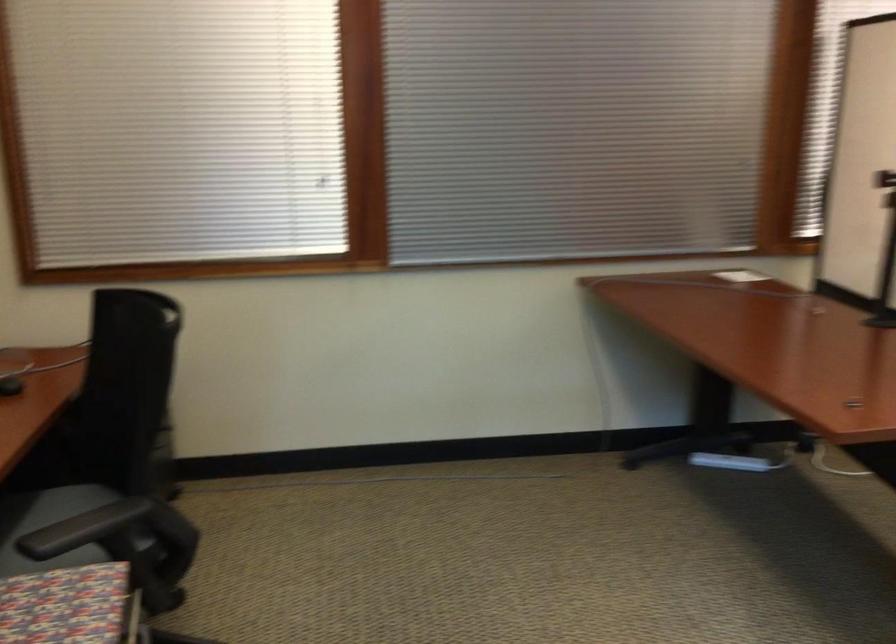
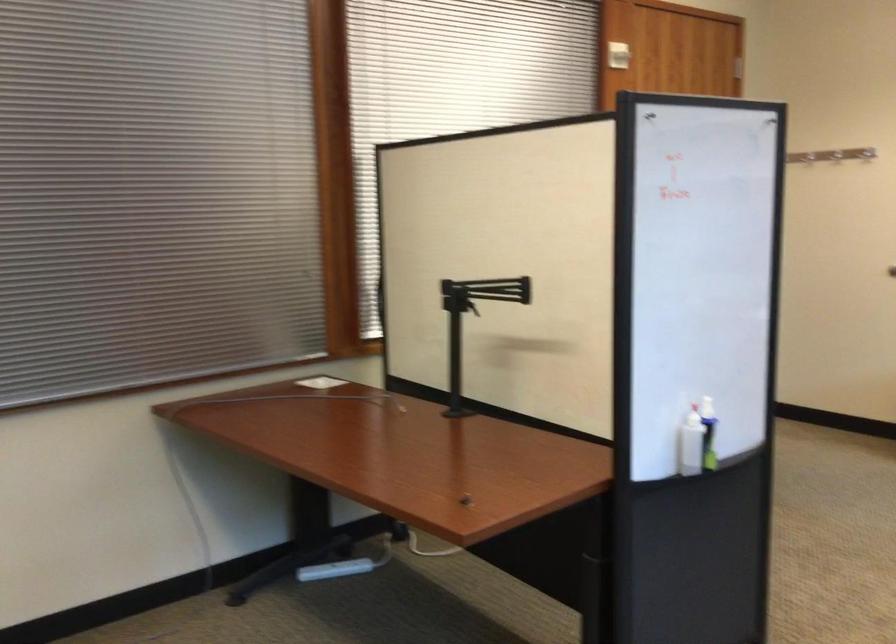
Question: The camera is either moving clockwise (left) or counter-clockwise (right) around the object. The first image is from the beginning of the video and the second image is from the end. Is the camera moving left or right when shooting the video?

Choices:
 (A) Left
 (B) Right

Answer: (A)